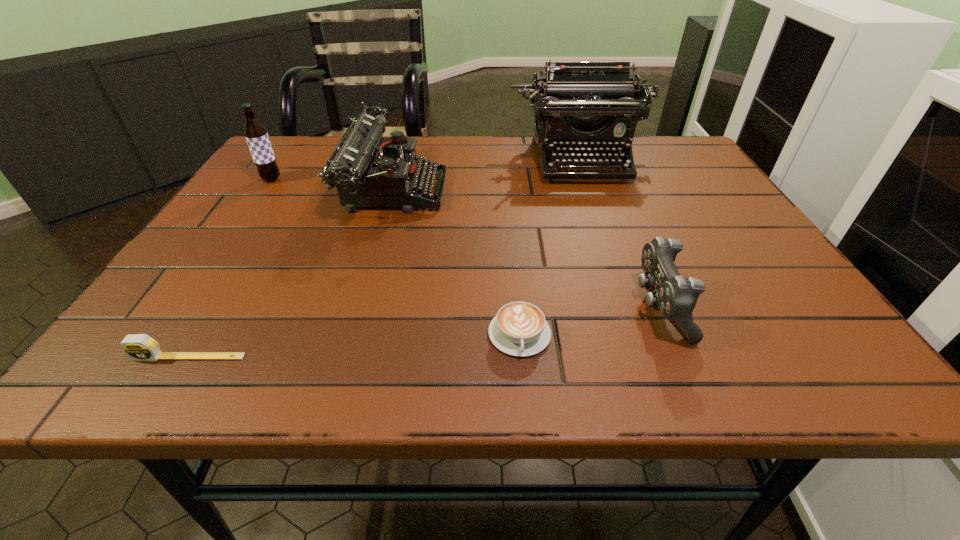
Where is `free region at the far right corner`? This screenshot has width=960, height=540. free region at the far right corner is located at coordinates (698, 167).

In order to click on free spot between the second shortest object and the fourth shortest object in this screenshot , I will do `click(292, 273)`.

This screenshot has width=960, height=540. Identify the location of vacant space in between the shortest object and the control. (589, 321).

Identify the location of free area in between the root beer and the third shortest object. (466, 244).

Find the location of a particular element. The image size is (960, 540). free area in between the right typewriter and the fourth object from right to left is located at coordinates (487, 174).

Locate an element on the screen. vacant area that lies between the fifth tallest object and the shortest object is located at coordinates click(x=354, y=346).

The width and height of the screenshot is (960, 540). Find the location of `empty space between the fifth tallest object and the cappuccino`. empty space between the fifth tallest object and the cappuccino is located at coordinates (354, 346).

Image resolution: width=960 pixels, height=540 pixels. I want to click on empty space between the taller typewriter and the control, so click(619, 234).

This screenshot has height=540, width=960. I want to click on vacant area that lies between the root beer and the tape measure, so click(x=230, y=268).

This screenshot has width=960, height=540. I want to click on object that ranks as the second closest to the third tallest object, so click(594, 106).